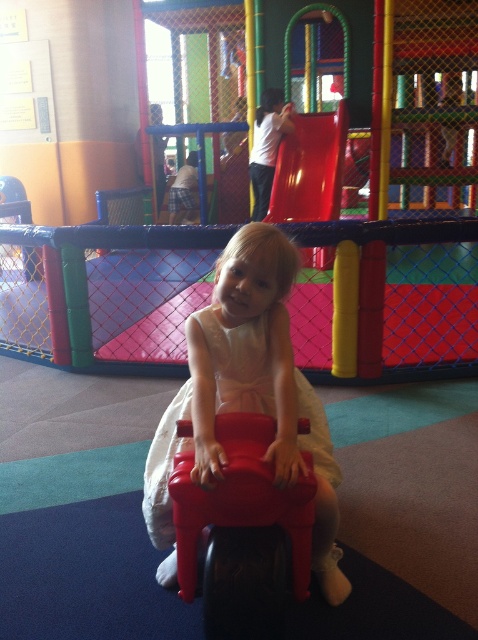
You are standing in the play area and want to know which of the two points, point [328,456] or point [296,134], is closer to you. Can you determine this based on the scene?

Point [328,456] is closer to the viewer than point [296,134].

You are a parent trying to take a photo of your child wearing the white satin dress at center. You want to ensure the shiny plastic slide at upper center is visible in the background. Given their sizes, will the slide be mostly visible behind the child?

The white satin dress at center has a smaller size compared to the shiny plastic slide at upper center. Since the slide is larger, it will likely be mostly visible behind the child wearing the smaller dress.

You are a parent trying to locate your child who is playing with a red plastic toy horse. You see a point marked at coordinates [241,499]. What object is located at that point?

The point at coordinates [241,499] corresponds to the rubberized red toy car at center.